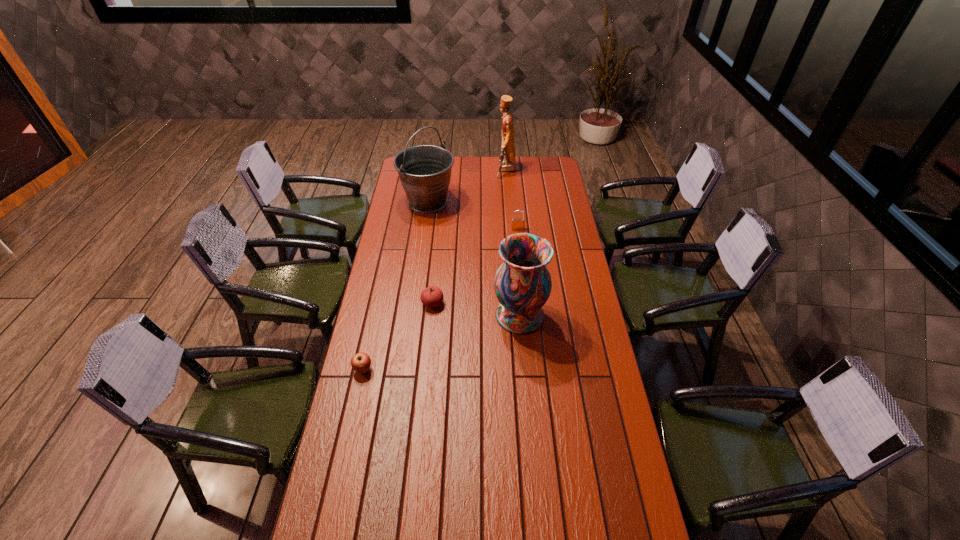
Where is `vacant region located on the front of the second farthest object`? The height and width of the screenshot is (540, 960). vacant region located on the front of the second farthest object is located at coordinates (418, 274).

The image size is (960, 540). Identify the location of free space located 0.120m on the front of the fourth shortest object. (524, 363).

Image resolution: width=960 pixels, height=540 pixels. I want to click on blank area located on the front-facing side of the fourth tallest object, so click(x=520, y=259).

Image resolution: width=960 pixels, height=540 pixels. I want to click on vacant area situated 0.360m on the right of the tomato, so click(x=531, y=303).

The image size is (960, 540). I want to click on vacant space located on the right of the nearest object, so click(x=397, y=369).

Locate an element on the screen. The height and width of the screenshot is (540, 960). object at the far edge is located at coordinates (507, 162).

Locate an element on the screen. This screenshot has height=540, width=960. bucket present at the left edge is located at coordinates (425, 170).

The image size is (960, 540). In order to click on apple at the left edge in this screenshot , I will do `click(360, 362)`.

Find the location of a particular element. blank space at the far edge of the desktop is located at coordinates (463, 178).

In the image, there is a desktop. At what (x,y) coordinates should I click in order to perform the action: click on free space at the left edge. Please return your answer as a coordinate pair (x, y). Looking at the image, I should click on (363, 395).